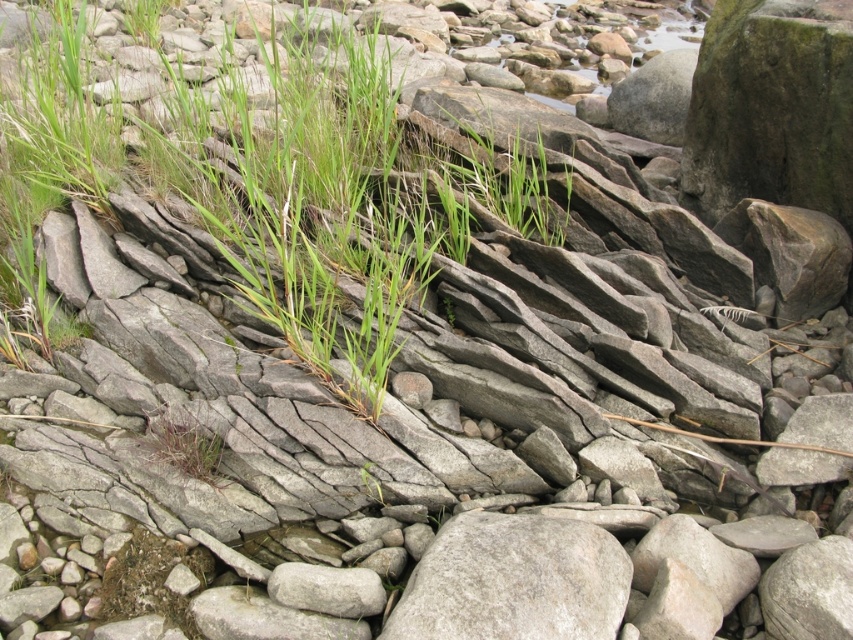
You are a hiker who wants to place a small backpack between the gray rough rock at center and the green grass at center. Which object should you place it closer to if you want the backpack to be more visible against the background?

The gray rough rock at center is bigger than the green grass at center, so placing the backpack closer to the gray rough rock at center would make it more visible against the background due to its larger size.

You are a hiker trying to cross this rocky area. You notice a gray rough rock at center and green grass at center. Which one is taller and would make it easier to step on?

The gray rough rock at center is taller than the green grass at center, making it easier to step on.